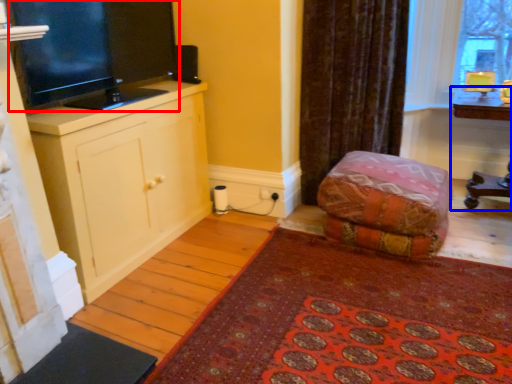
Question: Which of the following is the farthest to the observer, television (highlighted by a red box) or table (highlighted by a blue box)?

Choices:
 (A) television
 (B) table

Answer: (B)